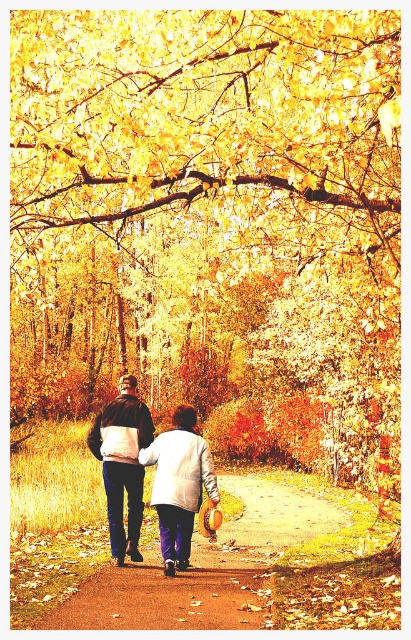
Looking at this image, who is positioned more to the left, white cotton jacket at center or dark brown leather jacket at center?

Positioned to the left is dark brown leather jacket at center.

Is white cotton jacket at center positioned before dark brown leather jacket at center?

That is True.

Between point (138, 493) and point (134, 500), which one is positioned behind?

The point (134, 500) is more distant.

Find the location of `white cotton jacket at center`. white cotton jacket at center is located at coordinates (122, 464).

Who is taller, brown dirt path at center or dark brown leather jacket at center?

brown dirt path at center

From the picture: Is brown dirt path at center below dark brown leather jacket at center?

Correct, brown dirt path at center is located below dark brown leather jacket at center.

Identify the location of brown dirt path at center. This screenshot has width=411, height=640. (203, 566).

Is brown dirt path at center further to camera compared to white cotton jacket at center?

No, it is not.

This screenshot has height=640, width=411. I want to click on brown dirt path at center, so click(x=203, y=566).